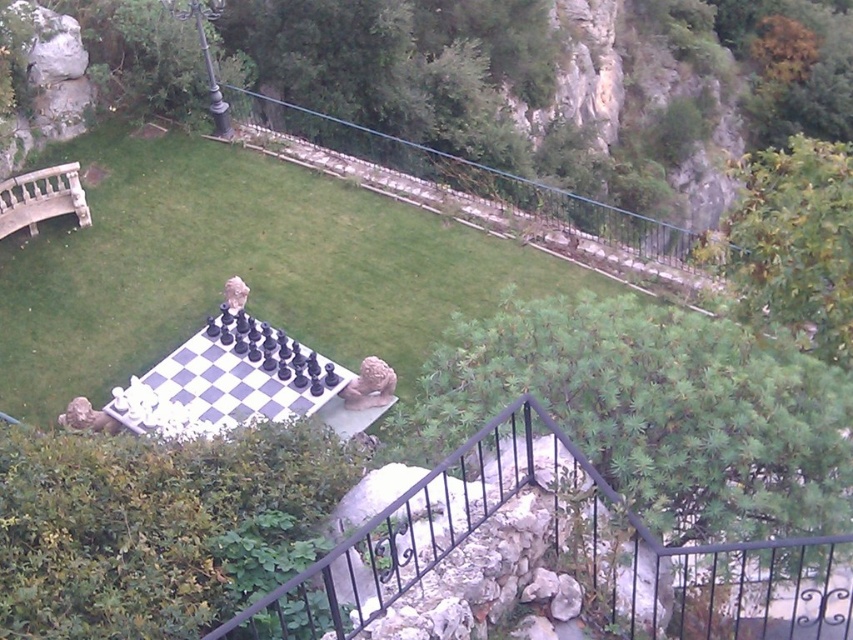
You are standing at the chessboard platform and want to walk towards the cliff edge. There are two points marked in the scene, point A at coordinates point A is point [194,420] and point B at point [76,208]. Which point should you head towards to reach the cliff edge?

You should head towards point B at [76,208] because it is behind point A at [194,420], meaning it is closer to the cliff edge.

Looking at this image, you are standing at the edge of the grassy area near the stone balustrade at left and want to walk to the white stone chessboard at center. Which direction should you move to get closer to the chessboard?

Since the white stone chessboard at center is closer to the viewer than the stone balustrade at left, you should move towards the center of the grassy area away from the stone balustrade at left to reach the chessboard.

You are a chess player standing at the edge of the grassy area near the metal railing. You want to move the white glossy chess set at center to the lower part of the white stone chessboard at center. Is this possible given their positions?

The white stone chessboard at center is located above the white glossy chess set at center, so moving the white glossy chess set at center to the lower part of the white stone chessboard at center is possible as the chess set is already positioned below the chessboard.